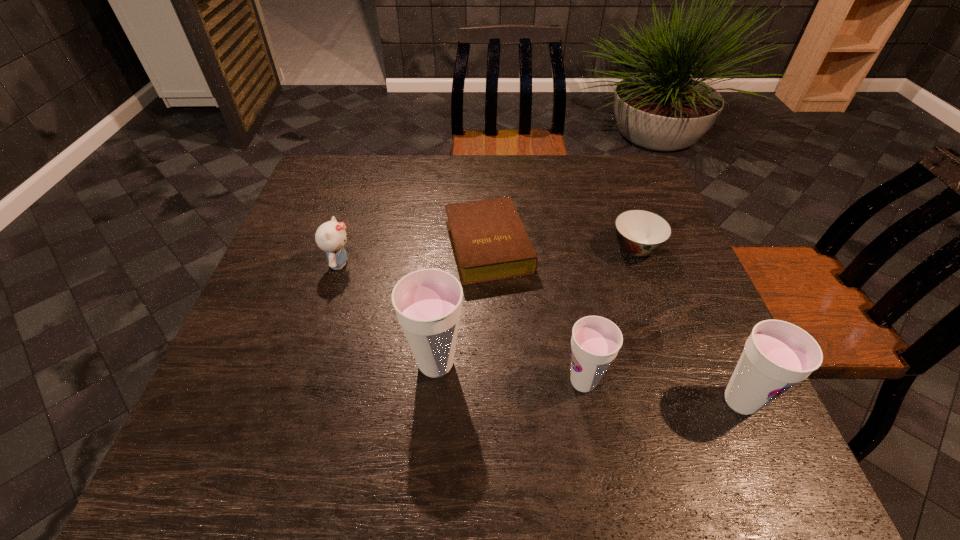
The height and width of the screenshot is (540, 960). Find the location of `free spot that satisfies the following two spatial constraints: 1. on the front side of the second tallest cup; 2. on the right side of the Bible`. free spot that satisfies the following two spatial constraints: 1. on the front side of the second tallest cup; 2. on the right side of the Bible is located at coordinates (492, 401).

Image resolution: width=960 pixels, height=540 pixels. In order to click on vacant space that satisfies the following two spatial constraints: 1. on the front side of the third tallest object; 2. on the right side of the leftmost cup in this screenshot , I will do `click(435, 382)`.